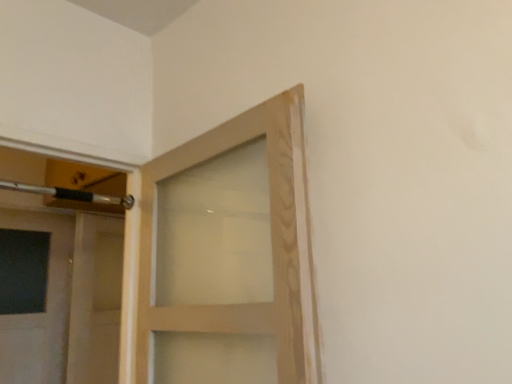
The width and height of the screenshot is (512, 384). What do you see at coordinates (95, 300) in the screenshot? I see `matte wood door at center` at bounding box center [95, 300].

Find the location of a particular element. The image size is (512, 384). matte wood door at center is located at coordinates (95, 300).

What do you see at coordinates (69, 194) in the screenshot? This screenshot has width=512, height=384. I see `metallic silver door handle at upper left` at bounding box center [69, 194].

You are a GUI agent. You are given a task and a screenshot of the screen. Output one action in this format:
    pyautogui.click(x=<x>, y=<y>)
    Task: Click on the metallic silver door handle at upper left
    The image size is (512, 384).
    Given the screenshot: What is the action you would take?
    click(69, 194)

Locate an element on the screen. This screenshot has width=512, height=384. matte wood door at center is located at coordinates (95, 300).

Considering the positions of objects metallic silver door handle at upper left and matte wood door at center in the image provided, who is more to the left, metallic silver door handle at upper left or matte wood door at center?

matte wood door at center is more to the left.

Considering their positions, is metallic silver door handle at upper left located in front of or behind matte wood door at center?

In the image, metallic silver door handle at upper left appears in front of matte wood door at center.

Considering the points (9, 187) and (112, 330), which point is in front, point (9, 187) or point (112, 330)?

The point (9, 187) is in front.

From the image's perspective, is metallic silver door handle at upper left on matte wood door at center?

Indeed, from the image's perspective, metallic silver door handle at upper left is shown above matte wood door at center.

From a real-world perspective, is metallic silver door handle at upper left on top of matte wood door at center?

Yes, from a real-world perspective, metallic silver door handle at upper left is over matte wood door at center

Can you confirm if metallic silver door handle at upper left is thinner than matte wood door at center?

Yes.

In the scene shown: From their relative heights in the image, would you say metallic silver door handle at upper left is taller or shorter than matte wood door at center?

Clearly, metallic silver door handle at upper left is shorter compared to matte wood door at center.

Which of these two, metallic silver door handle at upper left or matte wood door at center, is smaller?

metallic silver door handle at upper left is smaller.

From the picture: Which is correct: metallic silver door handle at upper left is inside matte wood door at center, or outside of it?

metallic silver door handle at upper left is located beyond the bounds of matte wood door at center.

Would you consider metallic silver door handle at upper left to be distant from matte wood door at center?

metallic silver door handle at upper left is actually quite close to matte wood door at center.

Does metallic silver door handle at upper left turn towards matte wood door at center?

No.

At what (x,y) coordinates should I click in order to perform the action: click on door handle above the matte wood door at center (from a real-world perspective). Please return your answer as a coordinate pair (x, y). Image resolution: width=512 pixels, height=384 pixels. Looking at the image, I should click on (69, 194).

Which object is positioned more to the right, matte wood door at center or metallic silver door handle at upper left?

metallic silver door handle at upper left is more to the right.

Consider the image. Which object is closer to the camera, matte wood door at center or metallic silver door handle at upper left?

metallic silver door handle at upper left is more forward.

Is point (123, 220) positioned before point (71, 194)?

No, it is behind (71, 194).

From the image's perspective, which is above, matte wood door at center or metallic silver door handle at upper left?

metallic silver door handle at upper left.

From a real-world perspective, between matte wood door at center and metallic silver door handle at upper left, who is vertically higher?

From a 3D spatial view, metallic silver door handle at upper left is above.

Considering the sizes of objects matte wood door at center and metallic silver door handle at upper left in the image provided, who is thinner, matte wood door at center or metallic silver door handle at upper left?

metallic silver door handle at upper left.

Considering the sizes of objects matte wood door at center and metallic silver door handle at upper left in the image provided, who is taller, matte wood door at center or metallic silver door handle at upper left?

matte wood door at center is taller.

In terms of size, does matte wood door at center appear bigger or smaller than metallic silver door handle at upper left?

Clearly, matte wood door at center is larger in size than metallic silver door handle at upper left.

Would you say metallic silver door handle at upper left is part of matte wood door at center's contents?

No, metallic silver door handle at upper left is not inside matte wood door at center.

Are matte wood door at center and metallic silver door handle at upper left making contact?

No, matte wood door at center is not in contact with metallic silver door handle at upper left.

Is matte wood door at center turned away from metallic silver door handle at upper left?

That's not correct — matte wood door at center is not looking away from metallic silver door handle at upper left.

How far apart are matte wood door at center and metallic silver door handle at upper left?

A distance of 35.99 inches exists between matte wood door at center and metallic silver door handle at upper left.

At what (x,y) coordinates should I click in order to perform the action: click on door handle that is on the right side of matte wood door at center. Please return your answer as a coordinate pair (x, y). The height and width of the screenshot is (384, 512). Looking at the image, I should click on point(69,194).

Locate an element on the screen. The image size is (512, 384). door that is below the metallic silver door handle at upper left (from the image's perspective) is located at coordinates (95, 300).

Where is `door handle in front of the matte wood door at center`? Image resolution: width=512 pixels, height=384 pixels. door handle in front of the matte wood door at center is located at coordinates (69, 194).